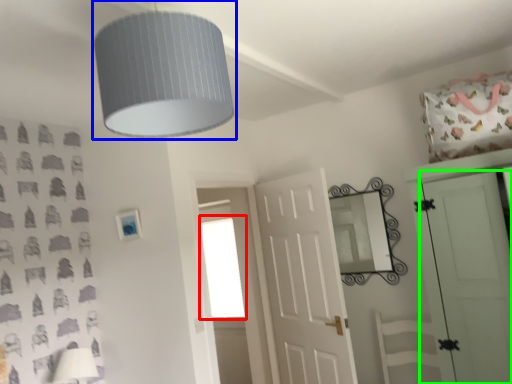
Question: Which object is positioned closest to window (highlighted by a red box)? Select from lamp (highlighted by a blue box) and door (highlighted by a green box).

Choices:
 (A) lamp
 (B) door

Answer: (B)